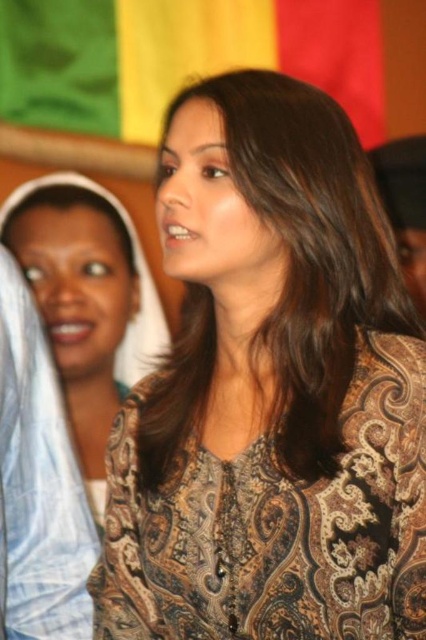
In the scene shown: Measure the distance between point (402,349) and camera.

Point (402,349) and camera are 3.39 feet apart from each other.

You are a GUI agent. You are given a task and a screenshot of the screen. Output one action in this format:
    pyautogui.click(x=<x>, y=<y>)
    Task: Click on the brown paisley fabric dress at center
    The height and width of the screenshot is (640, 426).
    Given the screenshot: What is the action you would take?
    coord(276,525)

Is brown textured hair at center above paisley-patterned blouse at center?

Correct, brown textured hair at center is located above paisley-patterned blouse at center.

Is the position of brown textured hair at center more distant than that of paisley-patterned blouse at center?

No, brown textured hair at center is in front of paisley-patterned blouse at center.

From the picture: Measure the distance between point (377, 248) and camera.

Point (377, 248) and camera are 3.72 feet apart from each other.

At what (x,y) coordinates should I click in order to perform the action: click on brown textured hair at center. Please return your answer as a coordinate pair (x, y). This screenshot has width=426, height=640. Looking at the image, I should click on (308, 250).

Does brown paisley fabric dress at center have a lesser height compared to brown textured hair at center?

Correct, brown paisley fabric dress at center is not as tall as brown textured hair at center.

Who is positioned more to the left, brown paisley fabric dress at center or brown textured hair at center?

brown paisley fabric dress at center

Identify the location of brown paisley fabric dress at center. This screenshot has height=640, width=426. (276, 525).